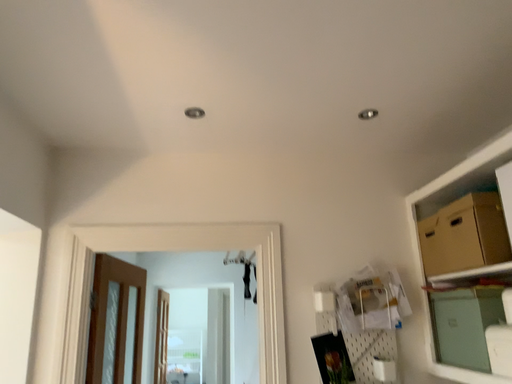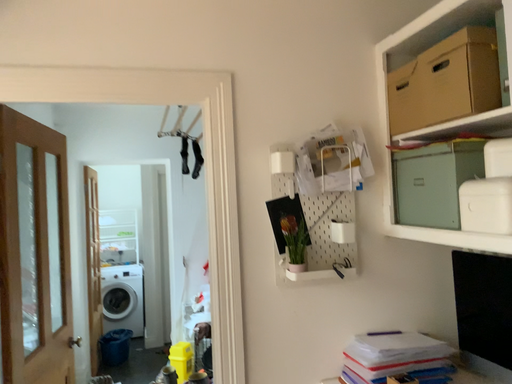
Question: Which way did the camera rotate in the video?

Choices:
 (A) rotated left
 (B) rotated right

Answer: (B)